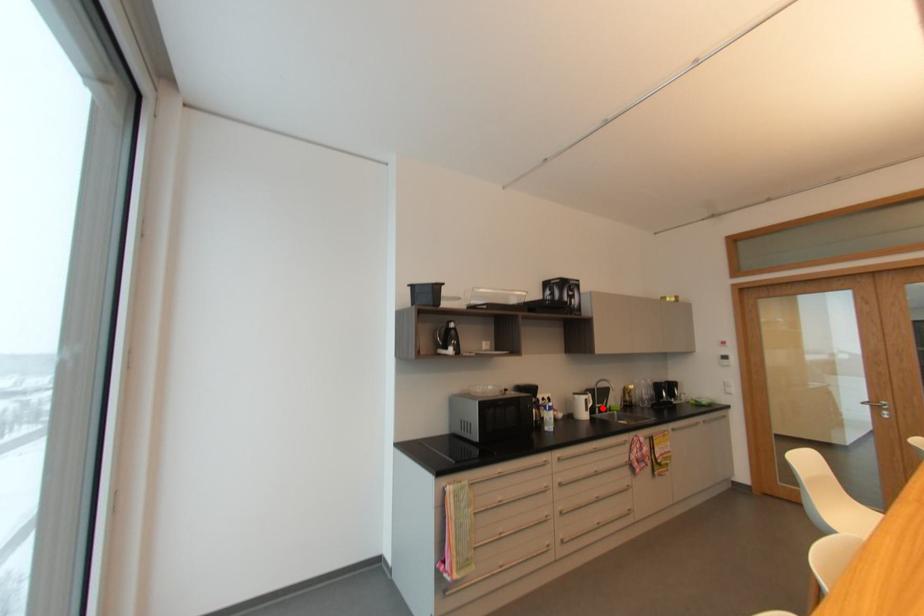
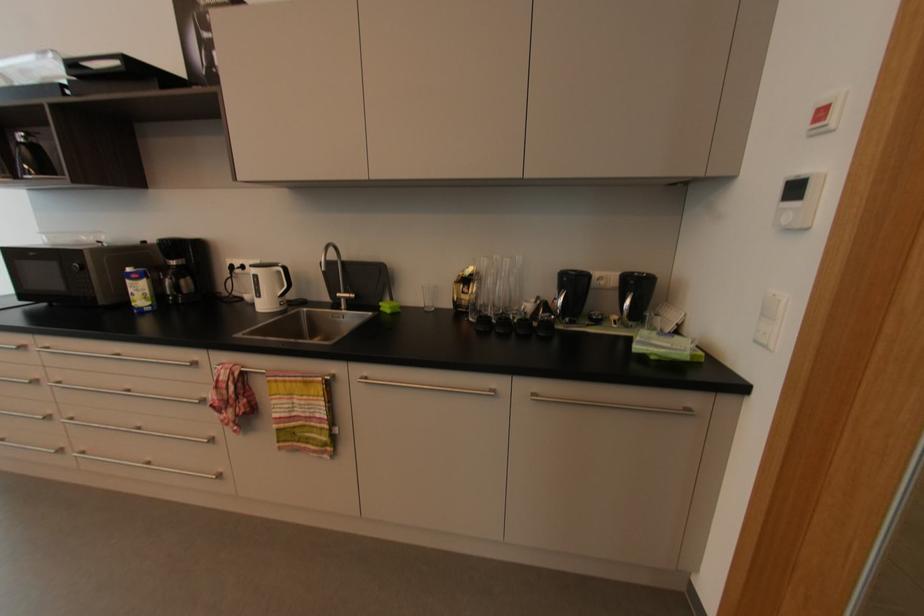
Question: I am providing you with two images of the same scene from different viewpoints. In image1, a red point is highlighted. Considering the same 3D point in image2, which of the following is correct?

Choices:
 (A) It is closer
 (B) It is farther

Answer: (A)